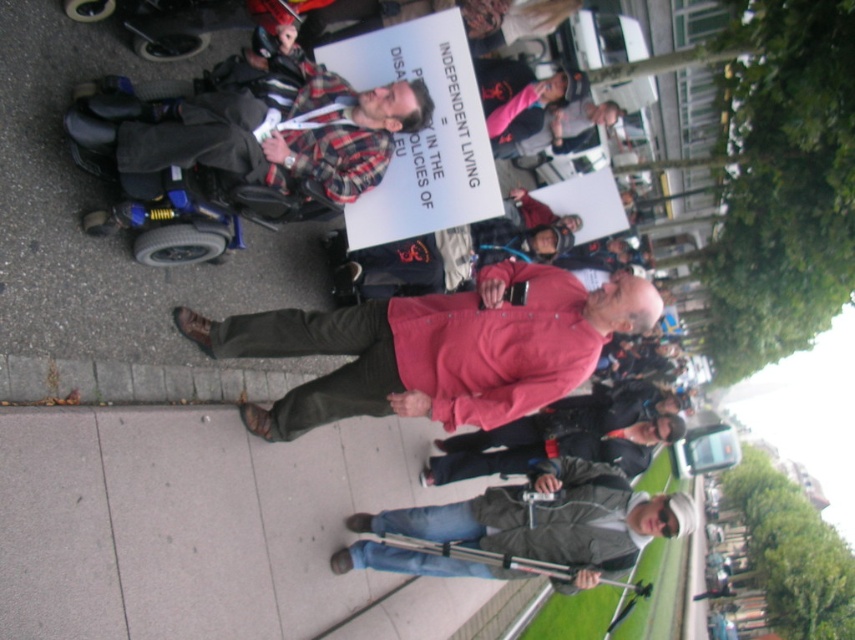
Between red cotton shirt at center and plaid fabric shirt at center, which one is positioned lower?

Positioned lower is red cotton shirt at center.

What do you see at coordinates (435, 348) in the screenshot? The image size is (855, 640). I see `red cotton shirt at center` at bounding box center [435, 348].

Image resolution: width=855 pixels, height=640 pixels. What are the coordinates of `red cotton shirt at center` in the screenshot? It's located at (435, 348).

Between gray concrete sidewalk at lower left and plaid fabric shirt at center, which one appears on the left side from the viewer's perspective?

plaid fabric shirt at center

Which of these two, gray concrete sidewalk at lower left or plaid fabric shirt at center, stands shorter?

plaid fabric shirt at center is shorter.

Who is more distant from viewer, (122, 586) or (361, 141)?

Positioned behind is point (361, 141).

Locate an element on the screen. The height and width of the screenshot is (640, 855). gray concrete sidewalk at lower left is located at coordinates (209, 531).

Is gray concrete sidewalk at lower left smaller than red cotton shirt at center?

Actually, gray concrete sidewalk at lower left might be larger than red cotton shirt at center.

Which is more to the right, gray concrete sidewalk at lower left or red cotton shirt at center?

red cotton shirt at center is more to the right.

What do you see at coordinates (209, 531) in the screenshot?
I see `gray concrete sidewalk at lower left` at bounding box center [209, 531].

Find the location of a particular element. This screenshot has width=855, height=640. gray concrete sidewalk at lower left is located at coordinates click(x=209, y=531).